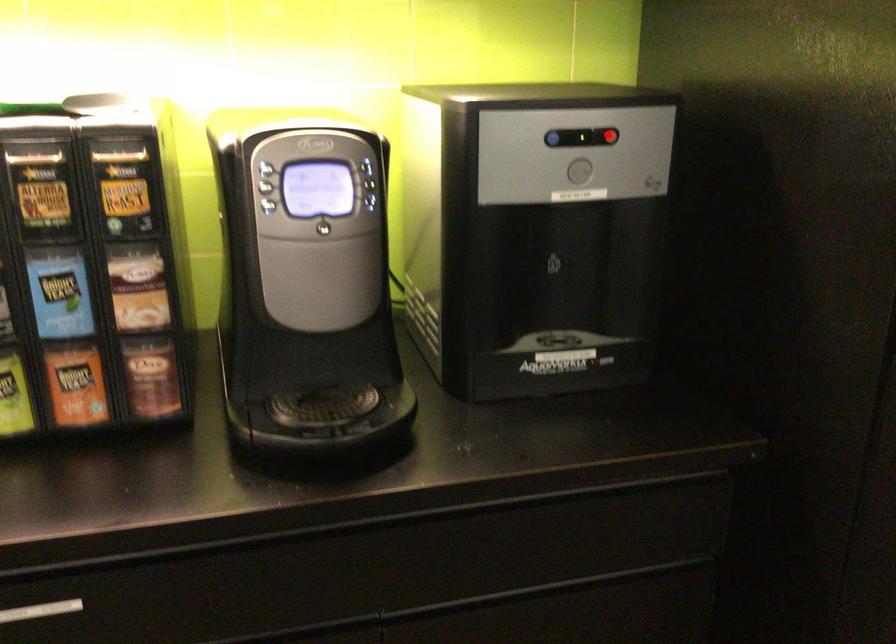
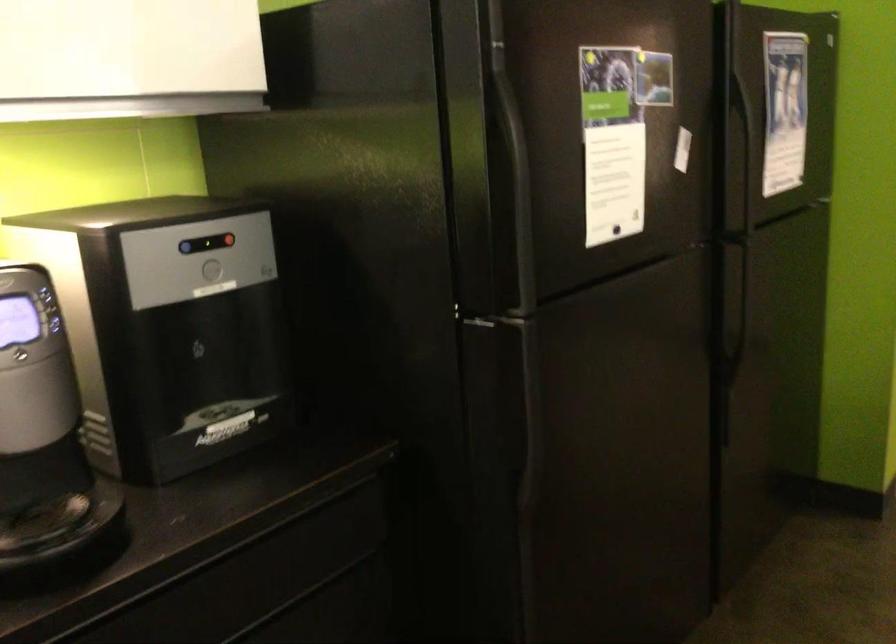
The point at the highlighted location is marked in the first image. Where is the corresponding point in the second image?

(227, 240)